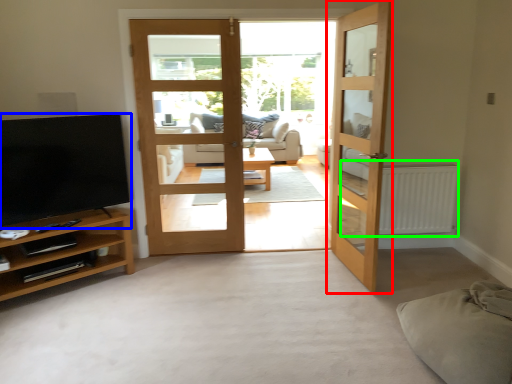
Question: Which is farther away from door (highlighted by a red box)? television (highlighted by a blue box) or radiator (highlighted by a green box)?

Choices:
 (A) television
 (B) radiator

Answer: (A)